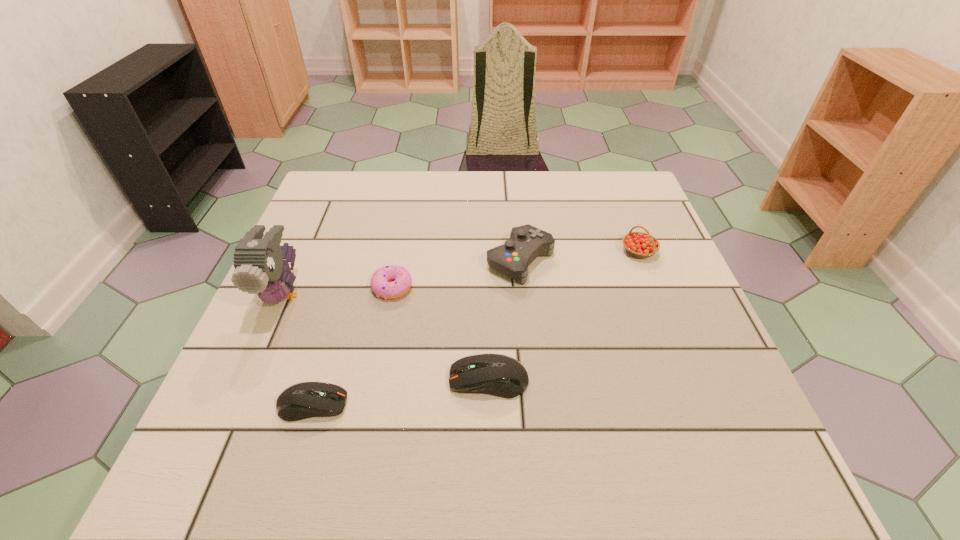
Where is `free space for a new computer equipment on the right`? free space for a new computer equipment on the right is located at coordinates (650, 357).